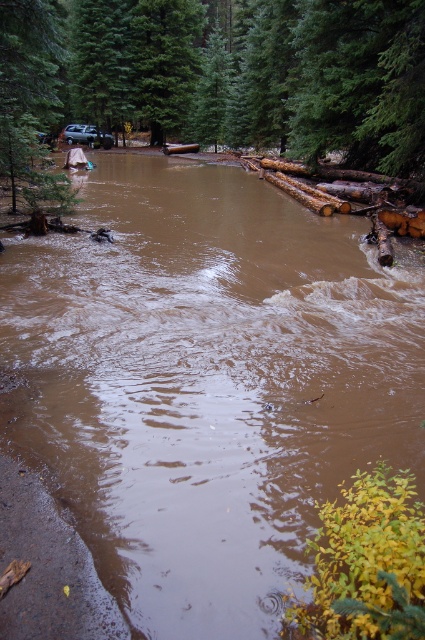
You are a rescue worker trying to reach a stranded vehicle in a flooded forest area. You see a green matte tree at upper left and a metallic silver suv at upper left. Which object is closer to you, the rescue worker?

The metallic silver suv at upper left is closer to you than the green matte tree at upper left because the distance between them is 25.17 meters.

You are a drone operator trying to capture a photo of the flooded forest area. The drone is currently at the center of the image. To ensure the green matte tree at upper center is in the frame, in which direction should you move the drone? Specify the direction as either north, south, east, or west based on the image coordinate system where the origin is at the bottom left corner.

The green matte tree at upper center is located at point (224, 74). Since the origin is at the bottom left corner, the x coordinate increases to the right and the y coordinate increases upward. The center of the image has coordinates around (212, 320). The tree is at x 0.117 which is to the left of center and y 0.529 which is slightly above center. To center the tree, the drone should move west to decrease the x coordinate further left and slightly south to lower the y coordinate. However since the drone s

You are a hiker trying to cross the flooded area in the forest. You notice two trees, the green matte tree at upper center and the green matte tree at upper left. Which tree would provide a wider base for anchoring your rope?

The green matte tree at upper center might be wider than the green matte tree at upper left, so it would provide a wider base for anchoring your rope.